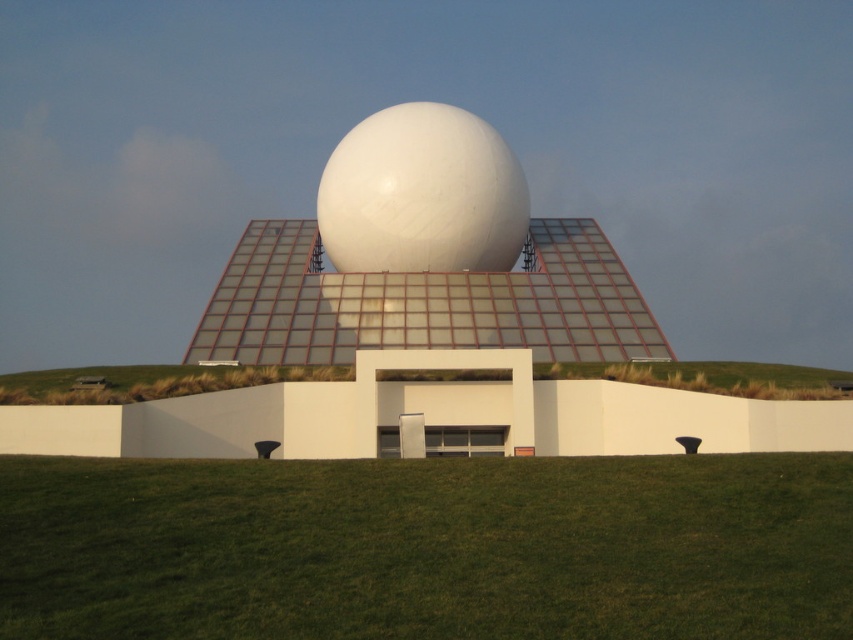
Does green grass at center appear under green grass at lower center?

Indeed, green grass at center is positioned under green grass at lower center.

Is green grass at center shorter than green grass at lower center?

No.

Is point (334, 513) farther from camera compared to point (59, 371)?

No, it is in front of (59, 371).

What are the coordinates of `green grass at center` in the screenshot? It's located at (427, 547).

Does green grass at center have a lesser width compared to white glossy sphere at center?

In fact, green grass at center might be wider than white glossy sphere at center.

Is point (509, 605) positioned after point (463, 198)?

No, it is not.

Between point (851, 589) and point (338, 188), which one is positioned in front?

Positioned in front is point (851, 589).

Image resolution: width=853 pixels, height=640 pixels. What are the coordinates of `green grass at center` in the screenshot? It's located at (427, 547).

Which of these two, white glossy sphere at center or green grass at lower center, stands taller?

Standing taller between the two is white glossy sphere at center.

Between white glossy sphere at center and green grass at lower center, which one is positioned higher?

white glossy sphere at center

Which is in front, point (367, 173) or point (770, 371)?

Point (770, 371) is in front.

Where is `white glossy sphere at center`? The height and width of the screenshot is (640, 853). white glossy sphere at center is located at coordinates (422, 195).